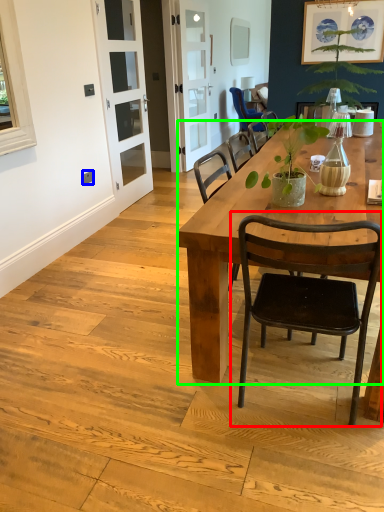
Question: Which is farther away from chair (highlighted by a red box)? power outlet (highlighted by a blue box) or desk (highlighted by a green box)?

Choices:
 (A) power outlet
 (B) desk

Answer: (A)